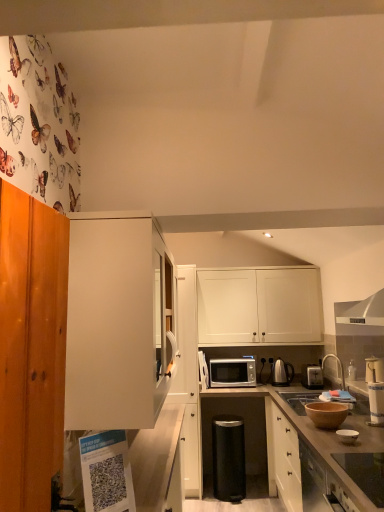
Question: From a real-world perspective, is white matte cabinet at center, which appears as the 2th cabinetry when viewed from the back, physically located above or below silver metallic faucet at upper right?

Choices:
 (A) below
 (B) above

Answer: (A)

Question: Considering the positions of white matte cabinet at center, the second cabinetry in the front-to-back sequence, and silver metallic faucet at upper right in the image, is white matte cabinet at center, the second cabinetry in the front-to-back sequence, taller or shorter than silver metallic faucet at upper right?

Choices:
 (A) short
 (B) tall

Answer: (B)

Question: Which of these objects is positioned farthest from the silver metallic toaster at right?

Choices:
 (A) wooden at center
 (B) white glossy bowl at lower right, positioned as the third appliance in bottom-to-top order
 (C) silver metallic microwave at center
 (D) metallic electric kettle at center-right, the second appliance from the bottom
 (E) matte white toaster at right, arranged as the first appliance when viewed from the top

Answer: (B)

Question: Which of these objects is positioned farthest from the white matte cabinet at center, the 2th cabinetry viewed from the left?

Choices:
 (A) silver metallic microwave at center
 (B) metallic electric kettle at center-right, the 1th appliance when ordered from back to front
 (C) silver metallic toaster at right
 (D) matte white toaster at right, marked as the third appliance in a front-to-back arrangement
 (E) wooden at center

Answer: (D)